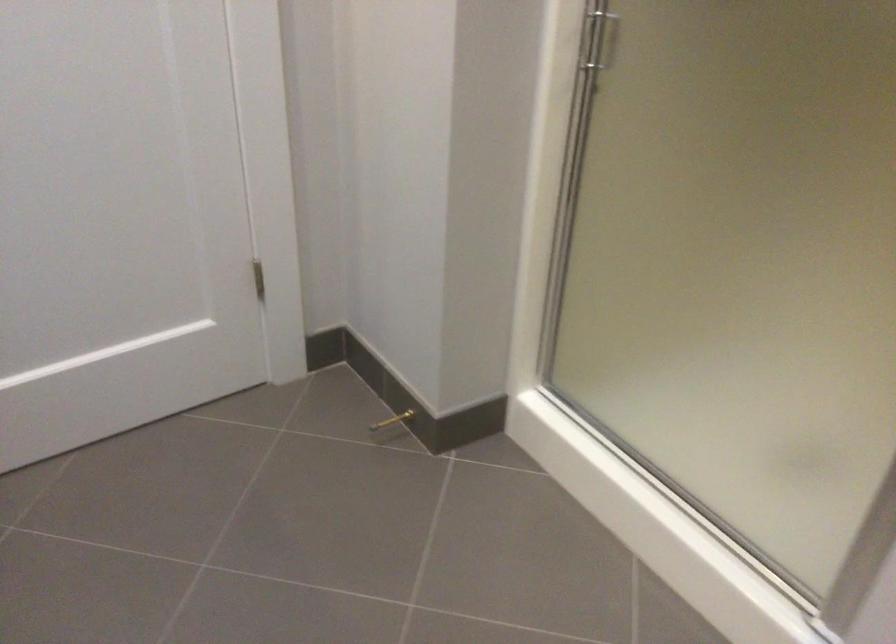
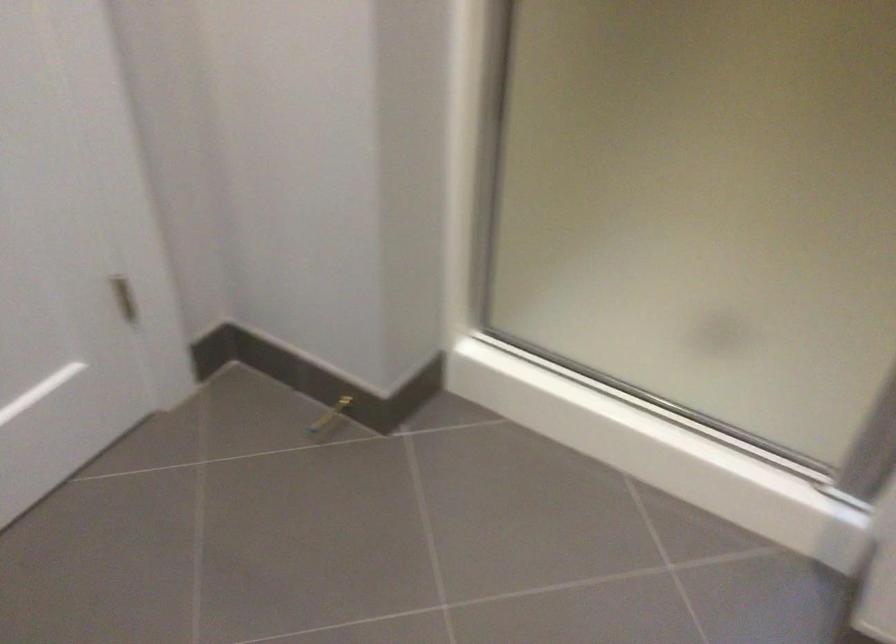
Question: The camera is either moving clockwise (left) or counter-clockwise (right) around the object. The first image is from the beginning of the video and the second image is from the end. Is the camera moving left or right when shooting the video?

Choices:
 (A) Left
 (B) Right

Answer: (A)